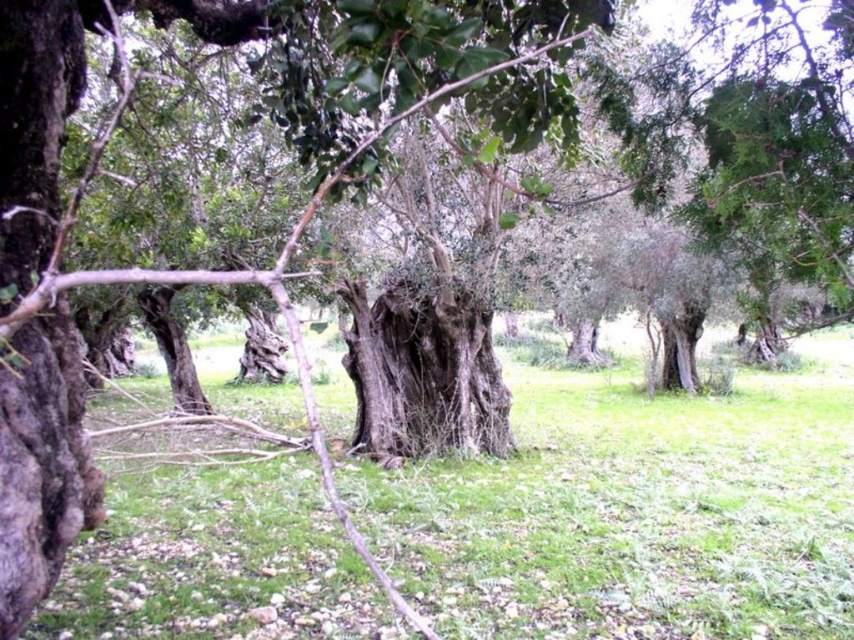
Question: Does dark brown rough bark at left appear over rough bark tree trunk at center?

Choices:
 (A) no
 (B) yes

Answer: (B)

Question: Among these objects, which one is nearest to the camera?

Choices:
 (A) green grass at center
 (B) rough bark tree trunk at center
 (C) dark brown rough bark at left

Answer: (C)

Question: Is green grass at center to the left of rough bark tree trunk at center from the viewer's perspective?

Choices:
 (A) no
 (B) yes

Answer: (A)

Question: Which object appears farthest from the camera in this image?

Choices:
 (A) rough bark tree trunk at center
 (B) green grass at center
 (C) dark brown rough bark at left

Answer: (A)

Question: Does green grass at center have a lesser width compared to rough bark tree trunk at center?

Choices:
 (A) yes
 (B) no

Answer: (B)

Question: Estimate the real-world distances between objects in this image. Which object is closer to the rough bark tree trunk at center?

Choices:
 (A) green grass at center
 (B) dark brown rough bark at left

Answer: (A)